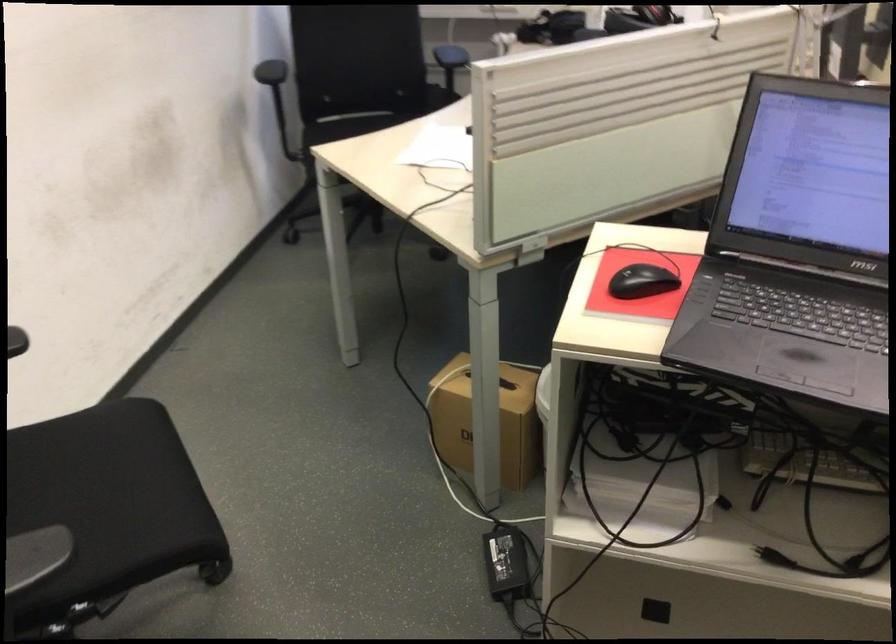
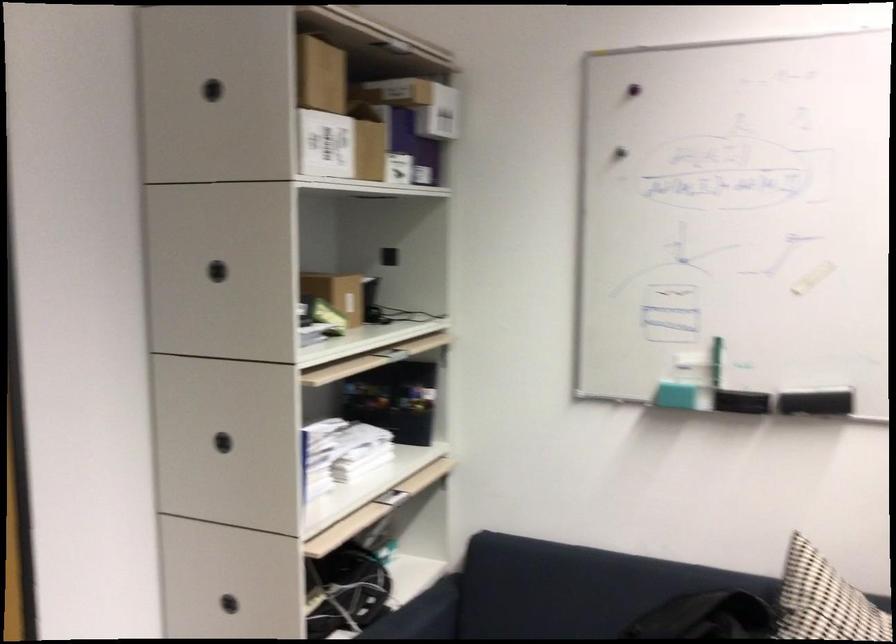
Based on the continuous images, in which direction is the camera rotating?

The rotation direction of the camera is left-down.